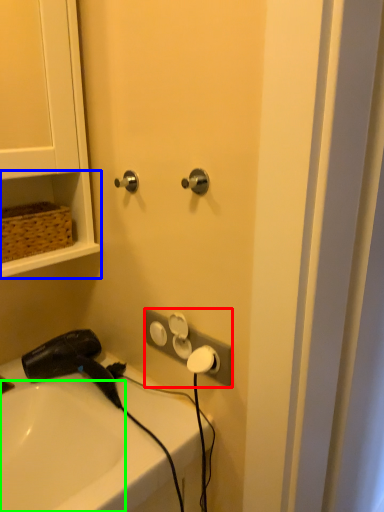
Question: Based on their relative distances, which object is farther from electric outlet (highlighted by a red box)? Choose from shelf (highlighted by a blue box) and sink (highlighted by a green box).

Choices:
 (A) shelf
 (B) sink

Answer: (A)